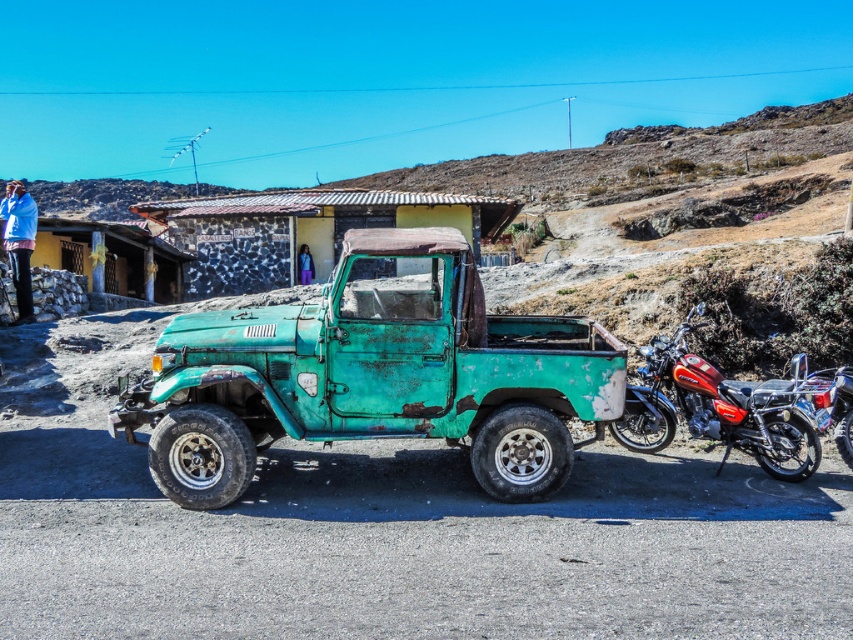
Question: Among these objects, which one is nearest to the camera?

Choices:
 (A) blue fabric jacket at upper left
 (B) rustic stone hut at center
 (C) purple fabric pants at center

Answer: (A)

Question: From the image, what is the correct spatial relationship of shiny red motorcycle at right in relation to purple fabric pants at center?

Choices:
 (A) left
 (B) right

Answer: (B)

Question: Which of these objects is positioned closest to the blue fabric jacket at upper left?

Choices:
 (A) rusty teal truck at center
 (B) rustic stone hut at center

Answer: (A)

Question: Does shiny red motorcycle at right have a lesser width compared to purple fabric pants at center?

Choices:
 (A) yes
 (B) no

Answer: (B)

Question: Where is rustic stone hut at center located in relation to blue fabric jacket at upper left in the image?

Choices:
 (A) below
 (B) above

Answer: (B)

Question: Based on their relative distances, which object is nearer to the blue fabric jacket at upper left?

Choices:
 (A) rusty teal truck at center
 (B) purple fabric pants at center

Answer: (A)